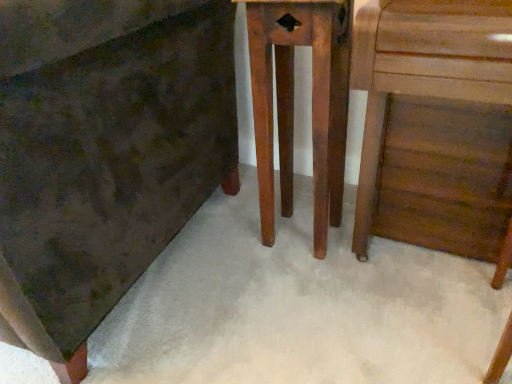
Identify the location of vacant space underneath wooden table at center (from a real-world perspective). The width and height of the screenshot is (512, 384). (294, 232).